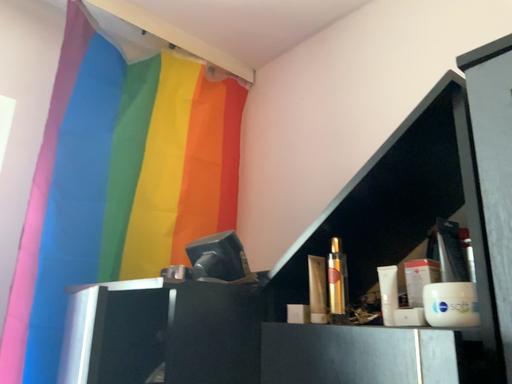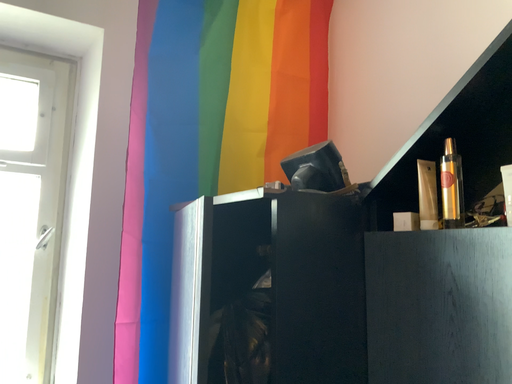
Question: How did the camera likely rotate when shooting the video?

Choices:
 (A) rotated upward
 (B) rotated downward

Answer: (B)